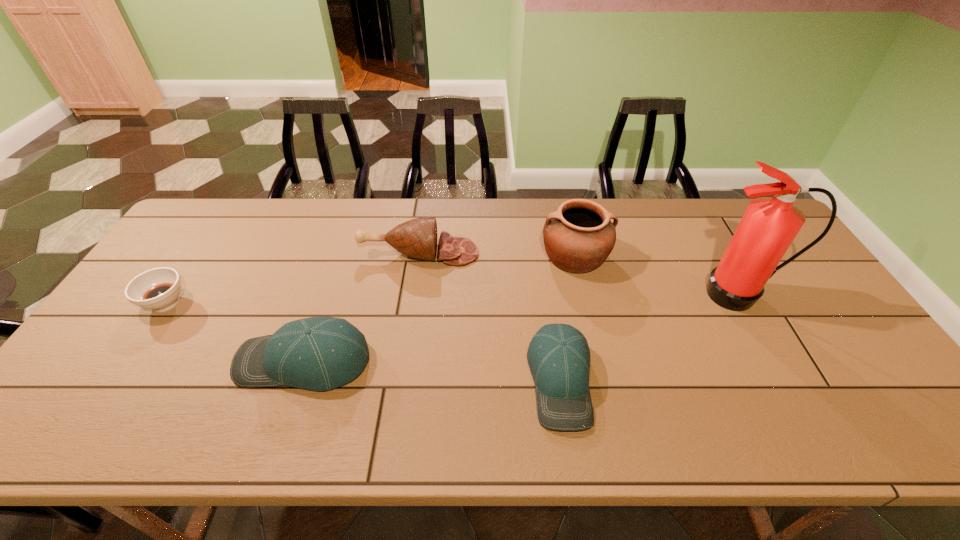
You are a GUI agent. You are given a task and a screenshot of the screen. Output one action in this format:
    pyautogui.click(x=<x>, y=<y>)
    Task: Click on the vacant area between the shorter baseball cap and the ham
    
    Given the screenshot: What is the action you would take?
    pyautogui.click(x=490, y=316)

Where is `empty location between the tallest object and the fifth shortest object`? empty location between the tallest object and the fifth shortest object is located at coordinates (658, 275).

Find the location of a particular element. object identified as the fifth closest to the rightmost object is located at coordinates (158, 289).

Select which object is the fourth closest to the right baseball cap. Please provide its 2D coordinates. Your answer should be formatted as a tuple, i.e. [(x, y)], where the tuple contains the x and y coordinates of a point satisfying the conditions above.

[(318, 353)]

Identify the location of vacant position in the image that satisfies the following two spatial constraints: 1. on the front side of the shortest object; 2. on the right side of the taller baseball cap. (127, 361).

This screenshot has width=960, height=540. In order to click on blank area in the image that satisfies the following two spatial constraints: 1. on the front side of the shorter baseball cap; 2. on the left side of the left baseball cap in this screenshot , I will do `click(298, 380)`.

Image resolution: width=960 pixels, height=540 pixels. I want to click on free space that satisfies the following two spatial constraints: 1. at the sliced end of the ham; 2. on the left side of the pottery, so click(x=419, y=256).

I want to click on vacant point that satisfies the following two spatial constraints: 1. on the front side of the shortest object; 2. on the right side of the left baseball cap, so click(x=127, y=361).